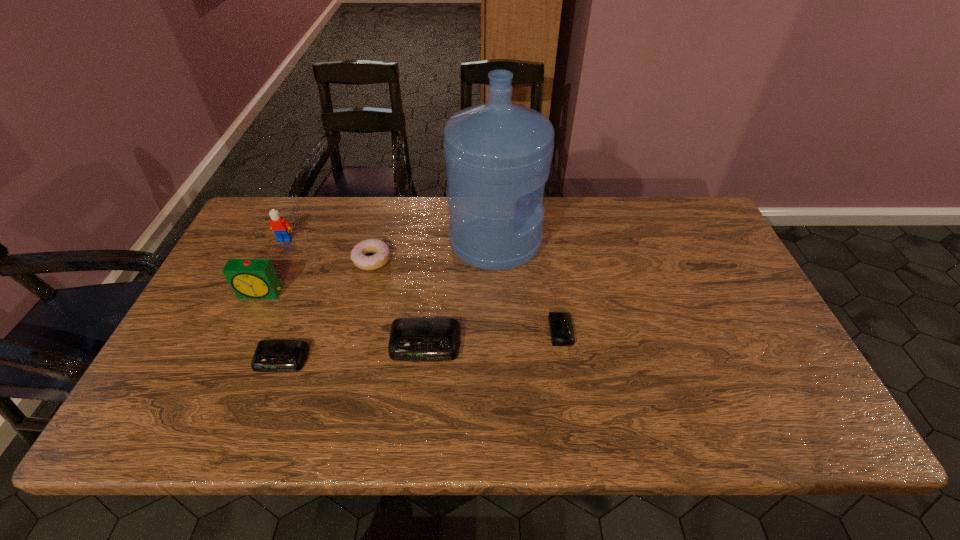
Please point a spot on the right to add another alarm clock. Please provide its 2D coordinates. Your answer should be formatted as a tuple, i.e. [(x, y)], where the tuple contains the x and y coordinates of a point satisfying the conditions above.

[(690, 318)]